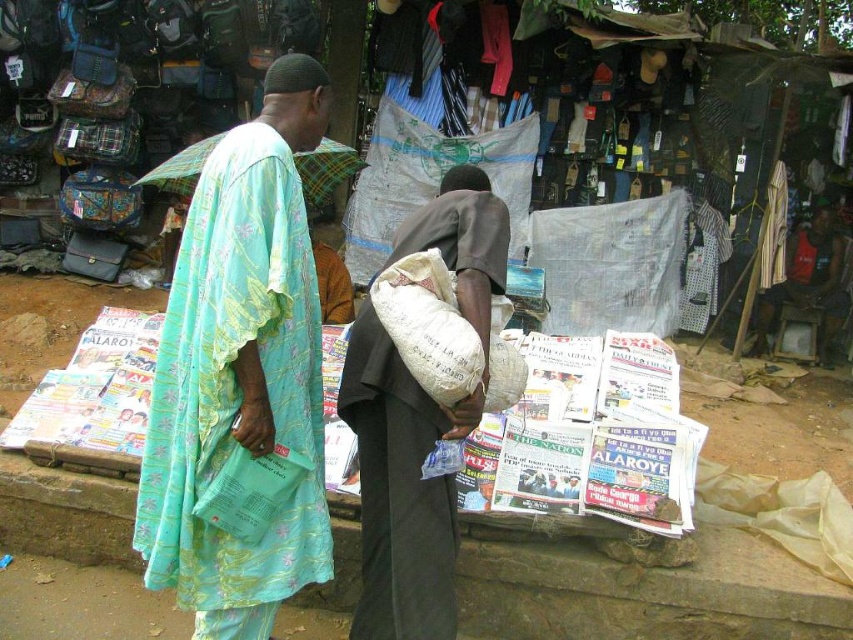
Question: Can you confirm if light blue floral fabric robe at left is positioned to the right of striped fabric shirt at center?

Choices:
 (A) no
 (B) yes

Answer: (A)

Question: Which of the following is the closest to the observer?

Choices:
 (A) (821, 266)
 (B) (704, 209)
 (C) (234, 227)
 (D) (376, 497)

Answer: (C)

Question: Does light blue floral fabric robe at left appear on the right side of dark brown fabric bag at center?

Choices:
 (A) no
 (B) yes

Answer: (A)

Question: Which object is farther from the camera taking this photo?

Choices:
 (A) light blue floral fabric robe at left
 (B) reddish-brown fabric shirt at right
 (C) striped fabric shirt at center

Answer: (B)

Question: Which point is closer to the camera taking this photo?

Choices:
 (A) pyautogui.click(x=817, y=348)
 (B) pyautogui.click(x=454, y=541)
 (C) pyautogui.click(x=321, y=460)

Answer: (B)

Question: Is dark brown fabric bag at center to the left of striped fabric shirt at center from the viewer's perspective?

Choices:
 (A) no
 (B) yes

Answer: (B)